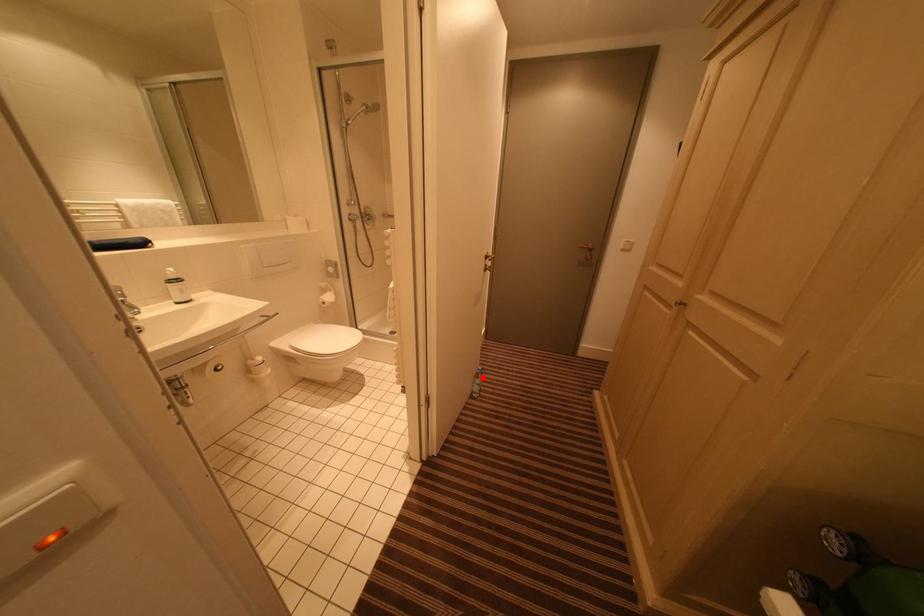
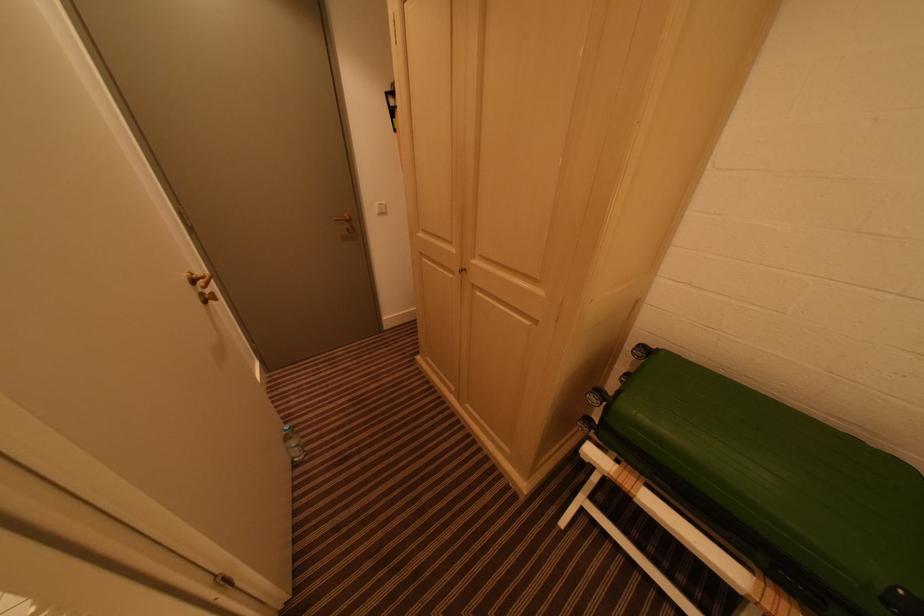
Question: I am providing you with two images of the same scene from different viewpoints. In image1, a red point is highlighted. Considering the same 3D point in image2, which of the following is correct?

Choices:
 (A) It is closer
 (B) It is farther

Answer: (A)